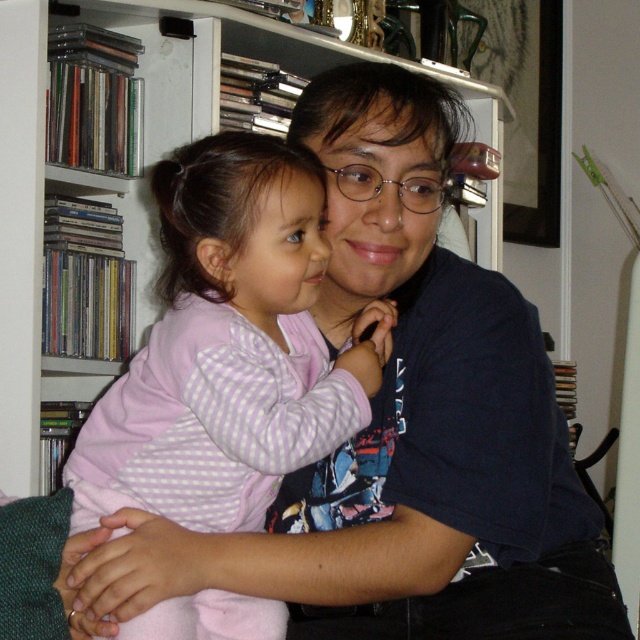
Based on the scene described, which object is taller, the pink checkered pajamas at center or the white plastic bookshelf at upper center?

The white plastic bookshelf at upper center is taller than the pink checkered pajamas at center according to the description.